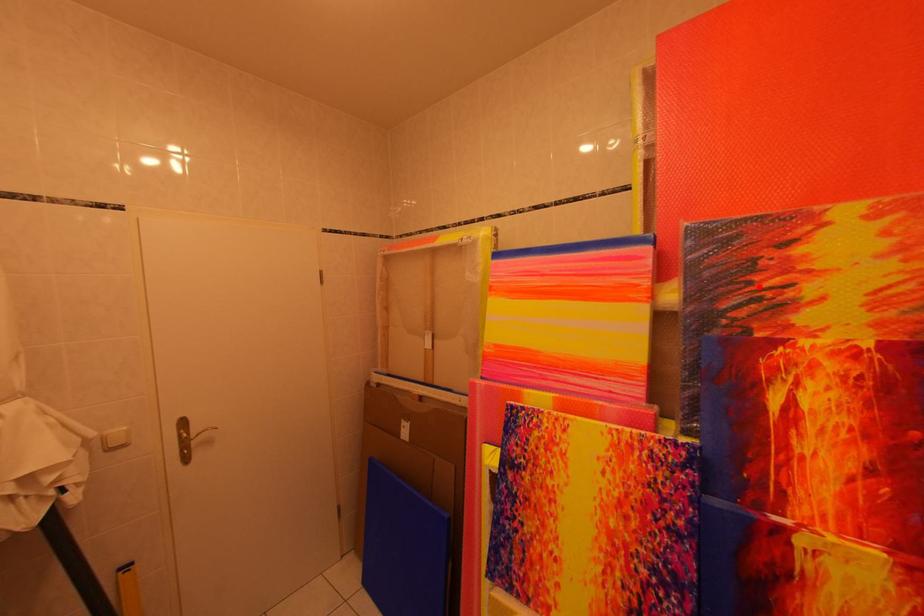
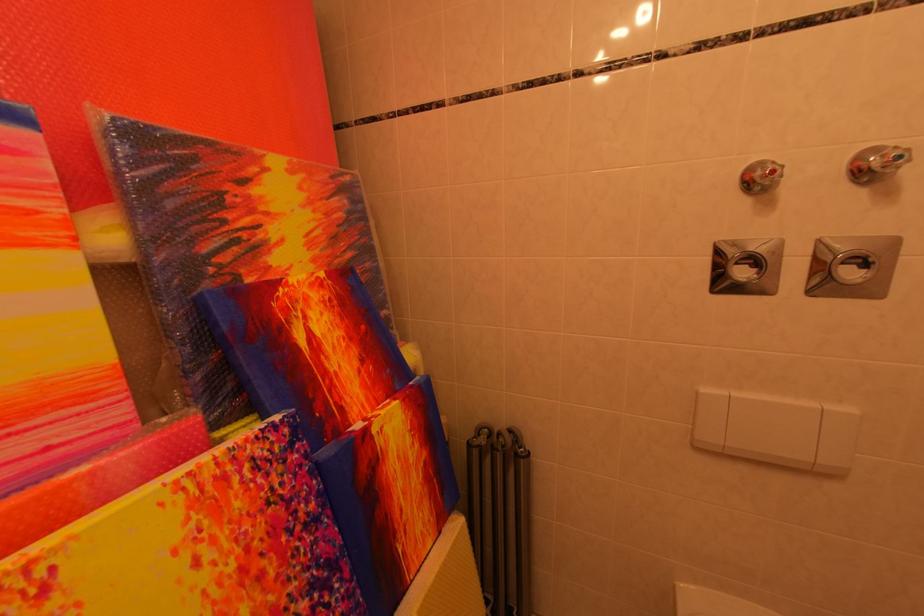
The point at the highlighted location is marked in the first image. Where is the corresponding point in the second image?

(233, 225)